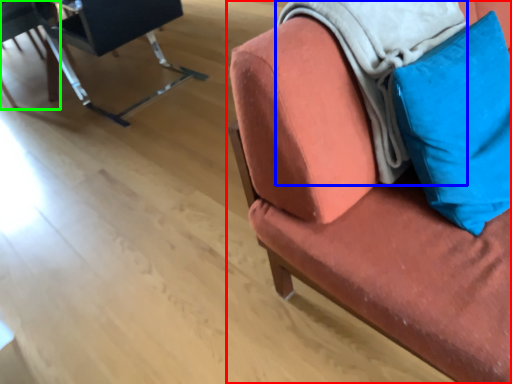
Question: Estimate the real-world distances between objects in this image. Which object is farther from chair (highlighted by a red box), blanket (highlighted by a blue box) or chair (highlighted by a green box)?

Choices:
 (A) blanket
 (B) chair

Answer: (B)